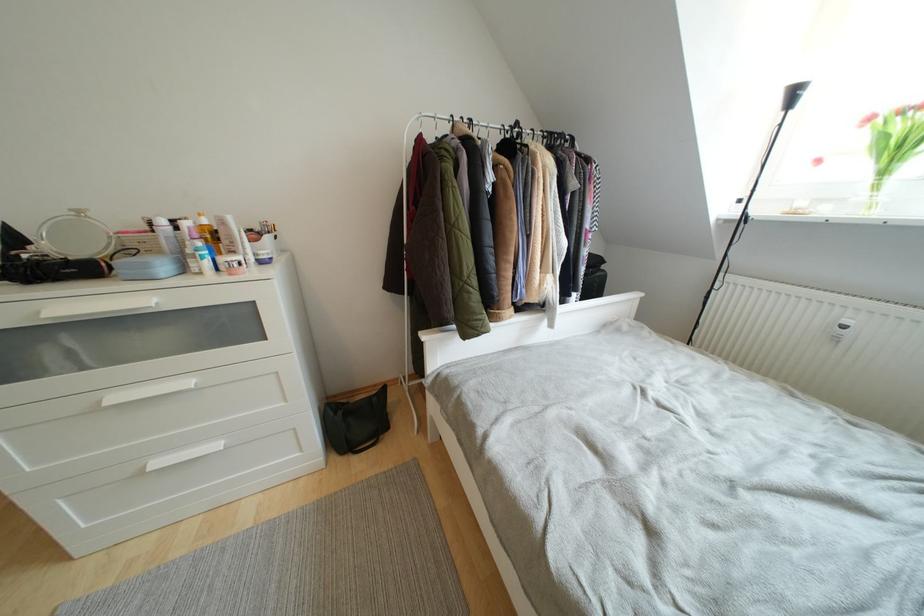
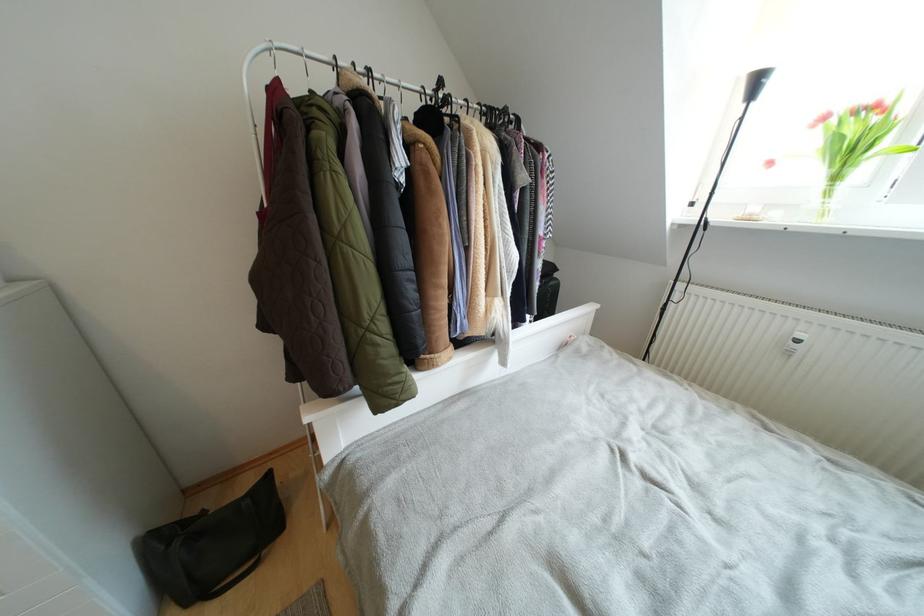
Where in the second image is the point corresponding to point 853,326 from the first image?

(805, 339)